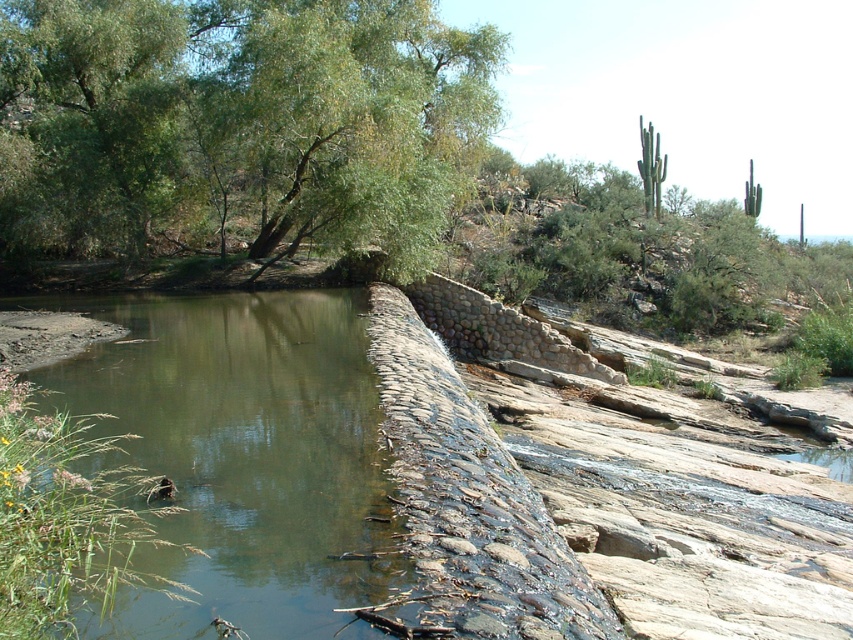
Is green leafy tree at upper left positioned at the back of greenish-brown stone river at lower left?

Result: That is True.

Describe the element at coordinates (238, 124) in the screenshot. I see `green leafy tree at upper left` at that location.

Where is `green leafy tree at upper left`? The height and width of the screenshot is (640, 853). green leafy tree at upper left is located at coordinates (238, 124).